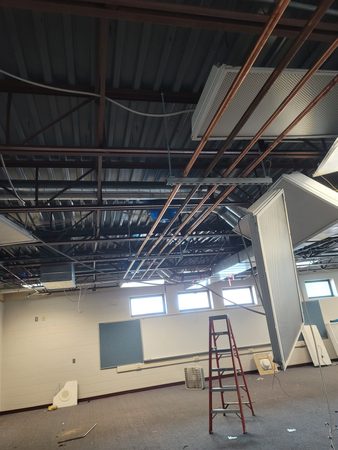
I want to click on white board, so click(321, 343).